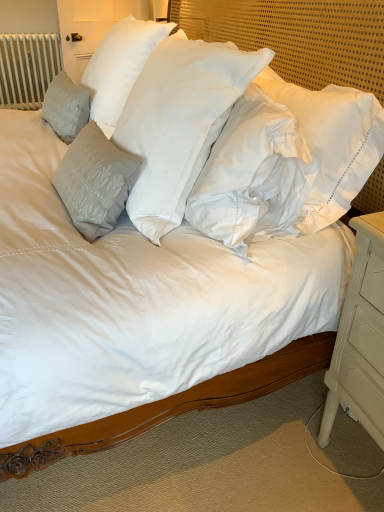
Question: Is white painted wood nightstand at lower right positioned before white textured fabric at upper center?

Choices:
 (A) no
 (B) yes

Answer: (B)

Question: From a real-world perspective, is white painted wood nightstand at lower right on top of white textured fabric at upper center?

Choices:
 (A) no
 (B) yes

Answer: (A)

Question: Does white painted wood nightstand at lower right have a lesser width compared to white textured fabric at upper center?

Choices:
 (A) yes
 (B) no

Answer: (B)

Question: Is white painted wood nightstand at lower right far away from white textured fabric at upper center?

Choices:
 (A) no
 (B) yes

Answer: (A)

Question: Is white painted wood nightstand at lower right taller than white textured fabric at upper center?

Choices:
 (A) no
 (B) yes

Answer: (A)

Question: From the image's perspective, does white painted wood nightstand at lower right appear lower than white textured fabric at upper center?

Choices:
 (A) yes
 (B) no

Answer: (A)

Question: From the image's perspective, is white textured fabric at upper center on gray textured pillow at left, arranged as the third pillow when viewed from the right?

Choices:
 (A) yes
 (B) no

Answer: (B)

Question: Is white textured fabric at upper center to the right of gray textured pillow at left, which ranks as the 1th pillow in left-to-right order, from the viewer's perspective?

Choices:
 (A) yes
 (B) no

Answer: (A)

Question: Could you tell me if white textured fabric at upper center is turned towards gray textured pillow at left, which ranks as the 1th pillow in left-to-right order?

Choices:
 (A) yes
 (B) no

Answer: (B)

Question: Could gray textured pillow at left, which ranks as the 1th pillow in left-to-right order, be considered to be inside white textured fabric at upper center?

Choices:
 (A) yes
 (B) no

Answer: (B)

Question: Can you see white textured fabric at upper center touching gray textured pillow at left, which ranks as the 1th pillow in left-to-right order?

Choices:
 (A) yes
 (B) no

Answer: (B)

Question: Does white textured fabric at upper center have a larger size compared to gray textured pillow at left, arranged as the third pillow when viewed from the right?

Choices:
 (A) yes
 (B) no

Answer: (A)

Question: Does white cotton pillow at center, arranged as the 1th pillow when viewed from the right, touch satin gray pillow at left, the 2th pillow positioned from the right?

Choices:
 (A) yes
 (B) no

Answer: (B)